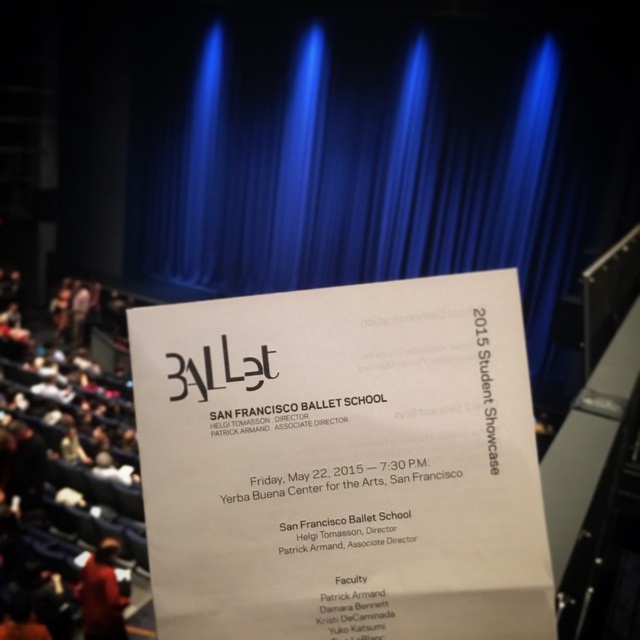
Looking at this image, who is taller, white paper at center or blue velvet curtain at center?

blue velvet curtain at center

Is white paper at center wider than blue velvet curtain at center?

Incorrect, white paper at center's width does not surpass blue velvet curtain at center's.

The height and width of the screenshot is (640, 640). Describe the element at coordinates (342, 464) in the screenshot. I see `white paper at center` at that location.

The width and height of the screenshot is (640, 640). What are the coordinates of `white paper at center` in the screenshot? It's located at (342, 464).

Can you confirm if blue velvet curtain at center is bigger than red fabric hat at lower left?

Indeed, blue velvet curtain at center has a larger size compared to red fabric hat at lower left.

Who is positioned more to the left, blue velvet curtain at center or red fabric hat at lower left?

From the viewer's perspective, red fabric hat at lower left appears more on the left side.

In the scene shown: Measure the distance between blue velvet curtain at center and camera.

The distance of blue velvet curtain at center from camera is 6.66 feet.

I want to click on blue velvet curtain at center, so click(380, 156).

Can you confirm if white paper at center is positioned to the right of red fabric hat at lower left?

Correct, you'll find white paper at center to the right of red fabric hat at lower left.

This screenshot has height=640, width=640. What do you see at coordinates (342, 464) in the screenshot?
I see `white paper at center` at bounding box center [342, 464].

Identify the location of white paper at center. pyautogui.click(x=342, y=464).